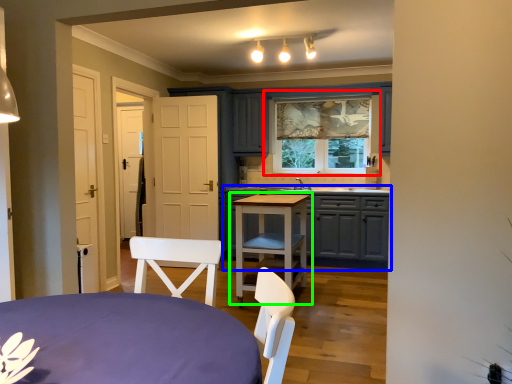
Question: Considering the real-world distances, which object is farthest from window (highlighted by a red box)? cabinetry (highlighted by a blue box) or table (highlighted by a green box)?

Choices:
 (A) cabinetry
 (B) table

Answer: (B)